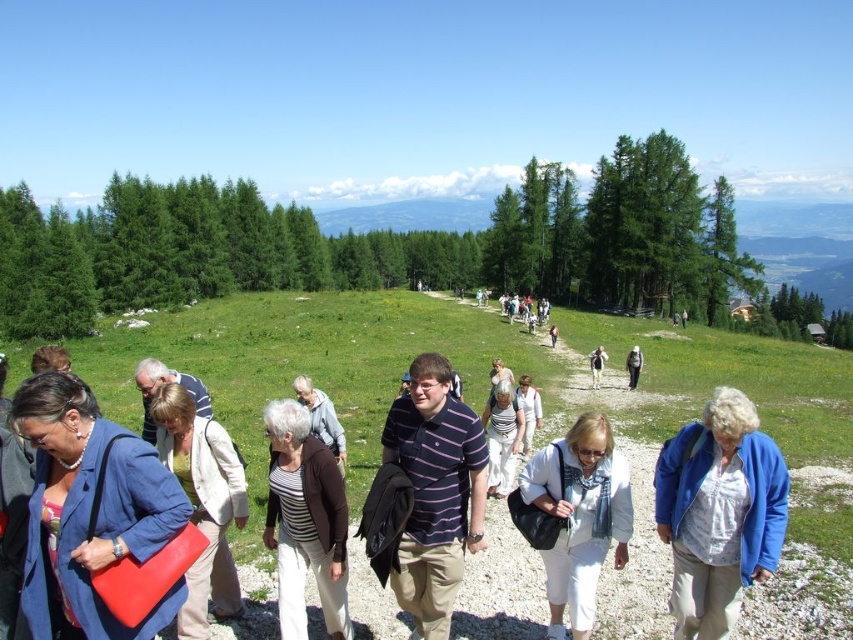
Question: Which point is farther from the camera taking this photo?

Choices:
 (A) (137, 364)
 (B) (556, 600)
 (C) (82, 400)

Answer: (A)

Question: Is the position of white fabric bag at center more distant than that of striped shirt at center?

Choices:
 (A) yes
 (B) no

Answer: (B)

Question: Among these objects, which one is farthest from the camera?

Choices:
 (A) light blue denim jacket at center
 (B) striped cotton polo shirt at center
 (C) white fabric bag at center

Answer: (A)

Question: Among these points, which one is nearest to the camera?

Choices:
 (A) (325, 534)
 (B) (537, 465)
 (C) (157, 368)

Answer: (A)

Question: Does striped knit sweater at center appear on the left side of matte beige jacket at center?

Choices:
 (A) no
 (B) yes

Answer: (A)

Question: Is white cotton dress at center smaller than striped sweater at center?

Choices:
 (A) yes
 (B) no

Answer: (A)